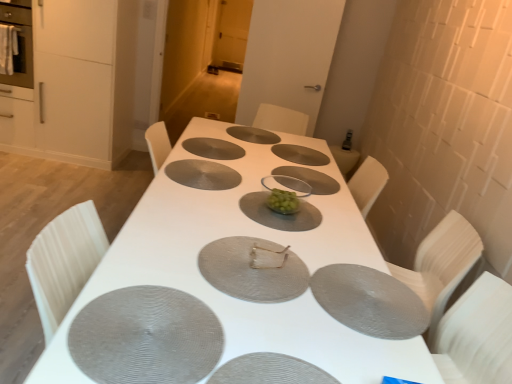
Identify the location of free space between matte gray pizza pan at center, which appears as the sixth pizza pan when viewed from the front, and gray textured placemat at lower right, which is the sixth pizza pan in back-to-front order. The width and height of the screenshot is (512, 384). (260, 188).